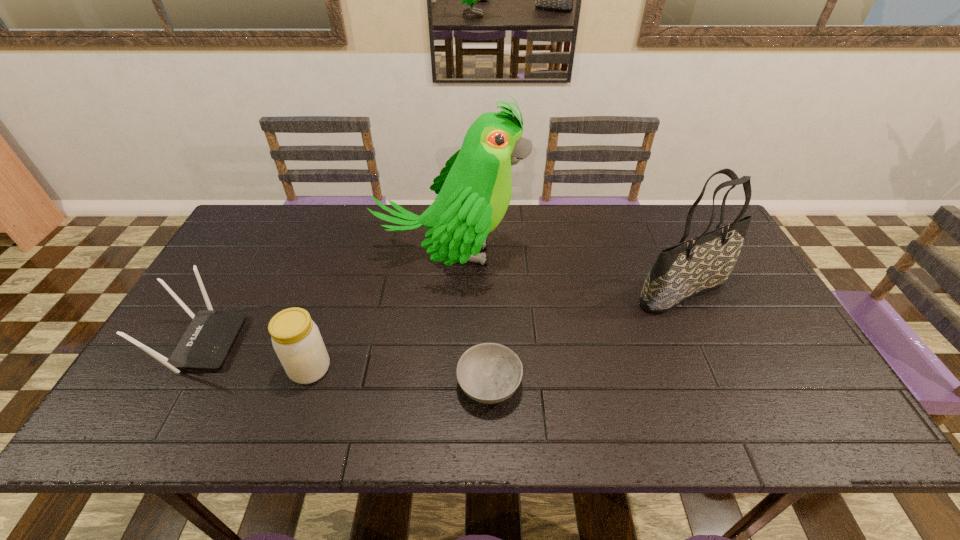
The width and height of the screenshot is (960, 540). In order to click on vacant point at the far right corner in this screenshot , I will do `click(681, 219)`.

The image size is (960, 540). In the image, there is a desktop. Identify the location of vacant space at the near right corner. (848, 434).

Locate an element on the screen. The image size is (960, 540). blank region between the tote bag and the tallest object is located at coordinates (567, 273).

Where is `empty location between the bowl and the second tallest object`? The height and width of the screenshot is (540, 960). empty location between the bowl and the second tallest object is located at coordinates (586, 338).

This screenshot has width=960, height=540. Find the location of `free spot between the shortest object and the router`. free spot between the shortest object and the router is located at coordinates (346, 363).

This screenshot has height=540, width=960. What are the coordinates of `free spot between the jar and the parakeet` in the screenshot? It's located at (380, 312).

You are a GUI agent. You are given a task and a screenshot of the screen. Output one action in this format:
    pyautogui.click(x=<x>, y=<y>)
    Task: Click on the empty space that is in between the bowl and the tallest object
    This screenshot has width=960, height=540.
    Given the screenshot: What is the action you would take?
    pyautogui.click(x=470, y=320)

Find the location of a particular element. free spot between the shortest object and the jar is located at coordinates (399, 376).

At what (x,y) coordinates should I click in order to perform the action: click on free space between the second tallest object and the shortest object. Please return your answer as a coordinate pair (x, y). Image resolution: width=960 pixels, height=540 pixels. Looking at the image, I should click on (586, 338).

The height and width of the screenshot is (540, 960). I want to click on unoccupied area between the leftmost object and the parakeet, so click(x=326, y=299).